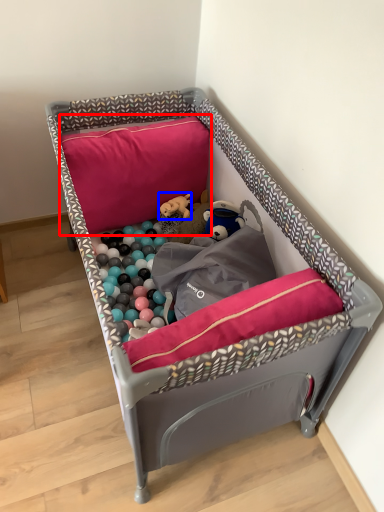
Question: Which object is further to the camera taking this photo, pillow (highlighted by a red box) or toy (highlighted by a blue box)?

Choices:
 (A) pillow
 (B) toy

Answer: (B)